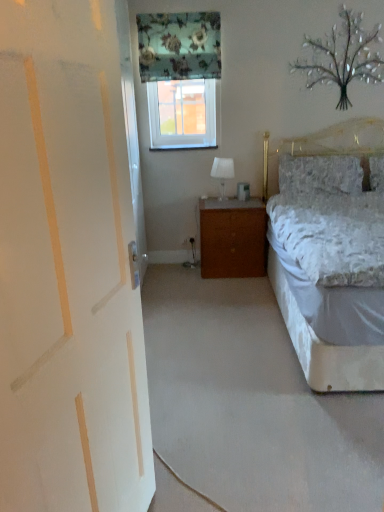
Question: From a real-world perspective, is white painted wood door at left under brown wood nightstand at center?

Choices:
 (A) yes
 (B) no

Answer: (B)

Question: Considering the relative positions of white painted wood door at left and brown wood nightstand at center in the image provided, is white painted wood door at left to the left of brown wood nightstand at center from the viewer's perspective?

Choices:
 (A) yes
 (B) no

Answer: (A)

Question: From the image's perspective, is white painted wood door at left located beneath brown wood nightstand at center?

Choices:
 (A) yes
 (B) no

Answer: (A)

Question: Is white painted wood door at left positioned in front of brown wood nightstand at center?

Choices:
 (A) no
 (B) yes

Answer: (B)

Question: Is white painted wood door at left thinner than brown wood nightstand at center?

Choices:
 (A) yes
 (B) no

Answer: (A)

Question: Would you say white painted wood door at left is outside brown wood nightstand at center?

Choices:
 (A) no
 (B) yes

Answer: (B)

Question: Considering the relative positions of metallic silver tree at upper right and brown wood nightstand at center in the image provided, is metallic silver tree at upper right to the left of brown wood nightstand at center from the viewer's perspective?

Choices:
 (A) yes
 (B) no

Answer: (B)

Question: Is metallic silver tree at upper right closer to camera compared to brown wood nightstand at center?

Choices:
 (A) yes
 (B) no

Answer: (A)

Question: Is metallic silver tree at upper right not within brown wood nightstand at center?

Choices:
 (A) yes
 (B) no

Answer: (A)

Question: Is the position of metallic silver tree at upper right more distant than that of brown wood nightstand at center?

Choices:
 (A) yes
 (B) no

Answer: (B)

Question: From a real-world perspective, is metallic silver tree at upper right below brown wood nightstand at center?

Choices:
 (A) no
 (B) yes

Answer: (A)

Question: Can you confirm if metallic silver tree at upper right is positioned to the right of brown wood nightstand at center?

Choices:
 (A) no
 (B) yes

Answer: (B)

Question: Is the position of floral fabric curtain at upper center more distant than that of white painted wood door at left?

Choices:
 (A) no
 (B) yes

Answer: (B)